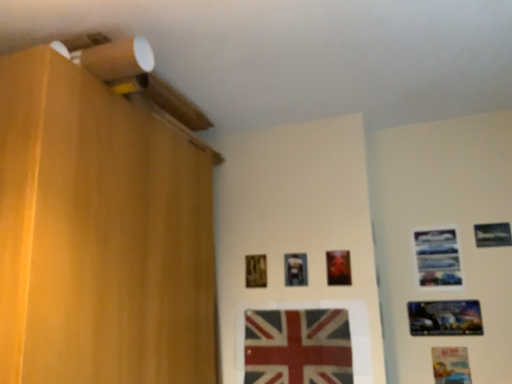
Question: Is metallic silver picture frame at upper right, the 7th picture frame viewed from the left, wider than red fabric flag at center?

Choices:
 (A) yes
 (B) no

Answer: (B)

Question: Are metallic silver picture frame at upper right, the 7th picture frame viewed from the left, and red fabric flag at center far apart?

Choices:
 (A) no
 (B) yes

Answer: (A)

Question: Is metallic silver picture frame at upper right, the first picture frame in the right-to-left sequence, oriented towards red fabric flag at center?

Choices:
 (A) yes
 (B) no

Answer: (B)

Question: Is metallic silver picture frame at upper right, the first picture frame in the right-to-left sequence, to the left of red fabric flag at center from the viewer's perspective?

Choices:
 (A) yes
 (B) no

Answer: (B)

Question: Is metallic silver picture frame at upper right, the first picture frame in the right-to-left sequence, positioned behind red fabric flag at center?

Choices:
 (A) no
 (B) yes

Answer: (B)

Question: From a real-world perspective, is metallic silver picture frame at upper right, the first picture frame in the right-to-left sequence, located higher than red fabric flag at center?

Choices:
 (A) no
 (B) yes

Answer: (B)

Question: From a real-world perspective, is metallic silver picture frame at upper right, marked as the fourth picture frame in a left-to-right arrangement, positioned under metallic silver picture frame at center, placed as the sixth picture frame when sorted from right to left, based on gravity?

Choices:
 (A) yes
 (B) no

Answer: (B)

Question: Is the depth of metallic silver picture frame at upper right, marked as the fourth picture frame in a left-to-right arrangement, less than that of metallic silver picture frame at center, the second picture frame from the left?

Choices:
 (A) no
 (B) yes

Answer: (A)

Question: Is metallic silver picture frame at upper right, which ranks as the fourth picture frame in right-to-left order, not within metallic silver picture frame at center, the second picture frame from the left?

Choices:
 (A) yes
 (B) no

Answer: (A)

Question: Does metallic silver picture frame at upper right, marked as the fourth picture frame in a left-to-right arrangement, have a larger size compared to metallic silver picture frame at center, placed as the sixth picture frame when sorted from right to left?

Choices:
 (A) yes
 (B) no

Answer: (A)

Question: Are metallic silver picture frame at upper right, which ranks as the fourth picture frame in right-to-left order, and metallic silver picture frame at center, the second picture frame from the left, making contact?

Choices:
 (A) yes
 (B) no

Answer: (B)

Question: Is metallic silver picture frame at upper right, marked as the fourth picture frame in a left-to-right arrangement, shorter than metallic silver picture frame at center, placed as the sixth picture frame when sorted from right to left?

Choices:
 (A) yes
 (B) no

Answer: (B)

Question: Considering the relative sizes of matte plastic picture frame at lower right, arranged as the second picture frame when viewed from the right, and wooden picture frame at center, the seventh picture frame positioned from the right, in the image provided, is matte plastic picture frame at lower right, arranged as the second picture frame when viewed from the right, taller than wooden picture frame at center, the seventh picture frame positioned from the right,?

Choices:
 (A) no
 (B) yes

Answer: (B)